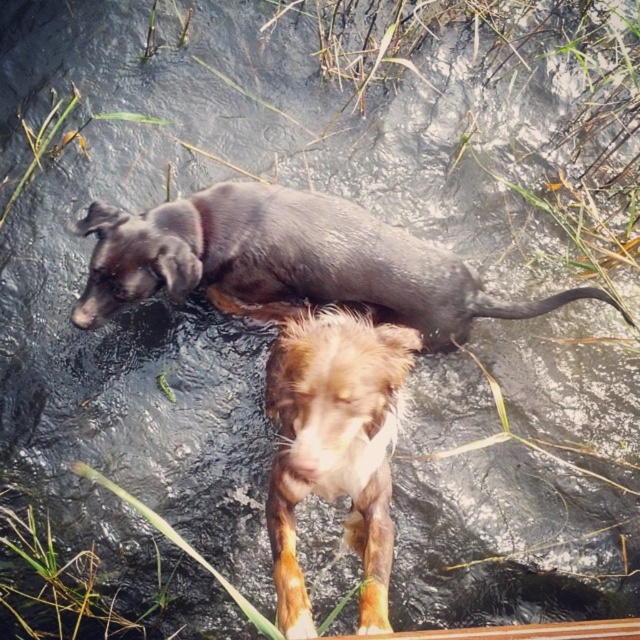
You are a photographer trying to capture both the shiny black dog at upper center and the brown furry dog at center in a single frame. Based on their sizes, which dog would appear larger in the photo?

The brown furry dog at center would appear larger in the photo because it is taller than the shiny black dog at upper center.

You are a photographer trying to capture a photo of both the shiny black dog at upper center and the brown furry dog at center. The minimum distance your camera can focus on two subjects clearly is 18 inches. Will you be able to take a clear photo of both dogs at the same time?

The distance between the shiny black dog at upper center and the brown furry dog at center is 18.23 inches, which is just over the minimum focusing distance of 18 inches. Therefore, the camera should be able to capture both dogs clearly in the same photo.

You are planning to take both dogs for a walk using a double leash. The leash can only handle two dogs if their combined size is under 100 units. If the shiny black dog at upper center is bigger than the brown furry dog at center, what is the minimum possible total size of both dogs?

Since the shiny black dog at upper center is bigger than the brown furry dog at center, the minimum total size would be when the brown furry dog at center is as small as possible. However, without specific size values, we can only state that the shiny black dog at upper center is larger, but cannot determine exact units. Thus, the leash capacity cannot be confirmed with the given information.